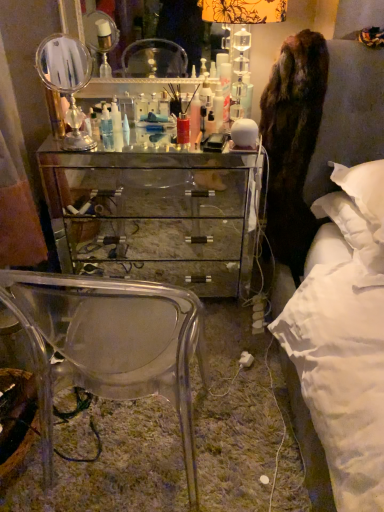
I want to click on free space that is in between clear plastic bottle at center, the second toiletry from the left, and white glossy bottle at center, which is the 1th toiletry from right to left, so click(160, 134).